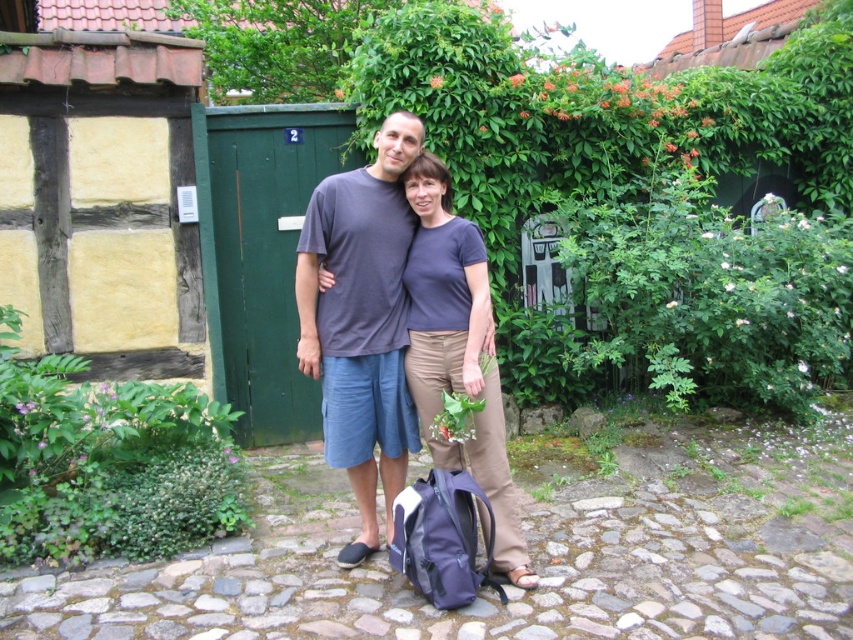
Question: Among these objects, which one is farthest from the camera?

Choices:
 (A) matte blue backpack at lower center
 (B) dark gray t-shirt at center

Answer: (B)

Question: Observing the image, what is the correct spatial positioning of dark gray t-shirt at center in reference to matte blue backpack at lower center?

Choices:
 (A) right
 (B) left

Answer: (B)

Question: Does dark gray t-shirt at center have a smaller size compared to matte blue backpack at lower center?

Choices:
 (A) yes
 (B) no

Answer: (B)

Question: Among these objects, which one is farthest from the camera?

Choices:
 (A) matte blue backpack at lower center
 (B) dark gray t-shirt at center

Answer: (B)

Question: Can you confirm if dark gray t-shirt at center is positioned to the left of matte blue backpack at lower center?

Choices:
 (A) yes
 (B) no

Answer: (A)